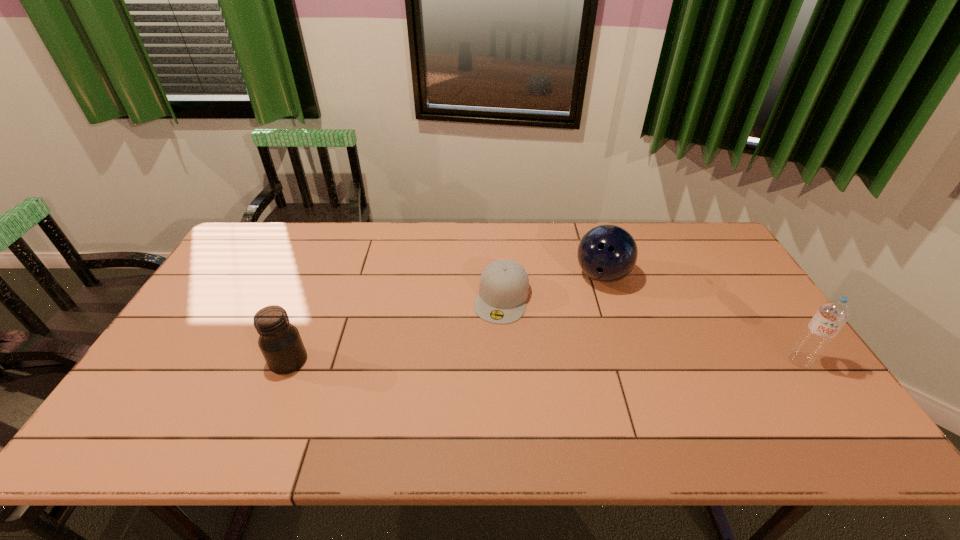
Identify the location of free spot on the desktop that is between the jar and the rightmost object and is positioned on the surface of the bowling ball near the finger holes. The height and width of the screenshot is (540, 960). (612, 361).

Where is `free space on the desktop that is between the jar and the water bottle and is positioned on the front-facing side of the cap`? free space on the desktop that is between the jar and the water bottle and is positioned on the front-facing side of the cap is located at coordinates (484, 361).